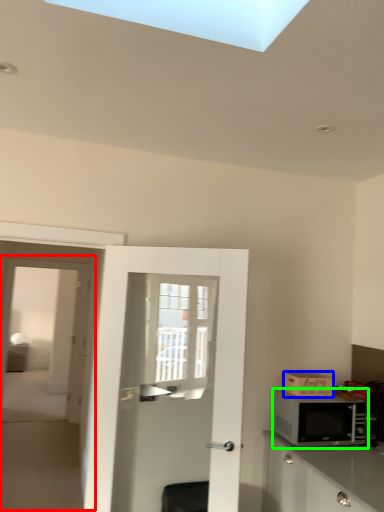
Question: Considering the real-world distances, which object is closest to screen door (highlighted by a red box)? cardboard box (highlighted by a blue box) or microwave oven (highlighted by a green box).

Choices:
 (A) cardboard box
 (B) microwave oven

Answer: (B)